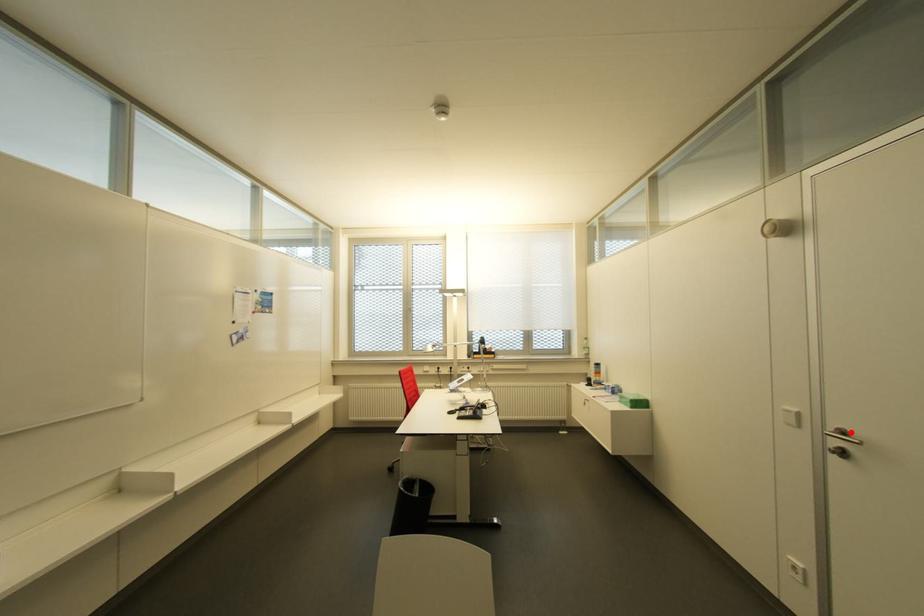
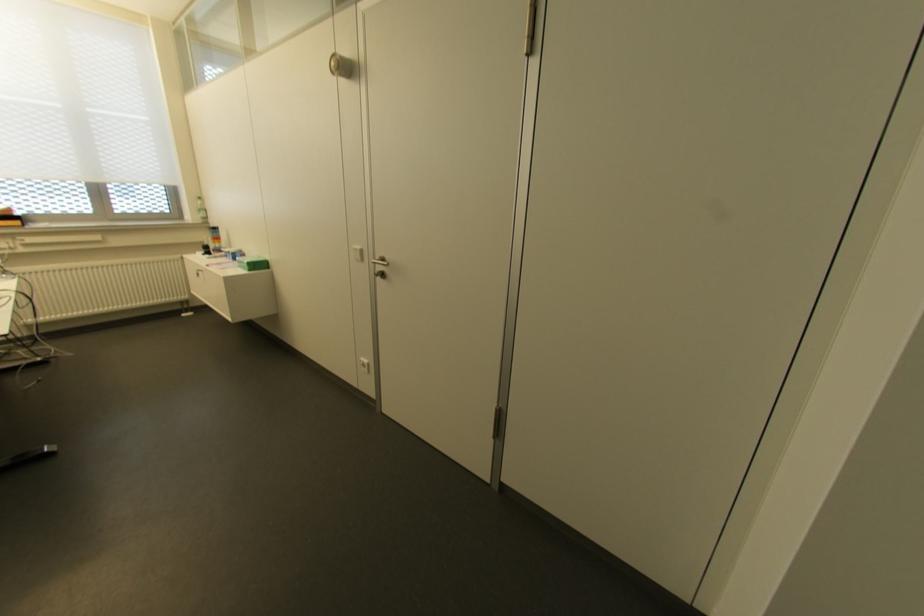
Find the pixel in the second image that matches the highlighted location in the first image.

(384, 257)